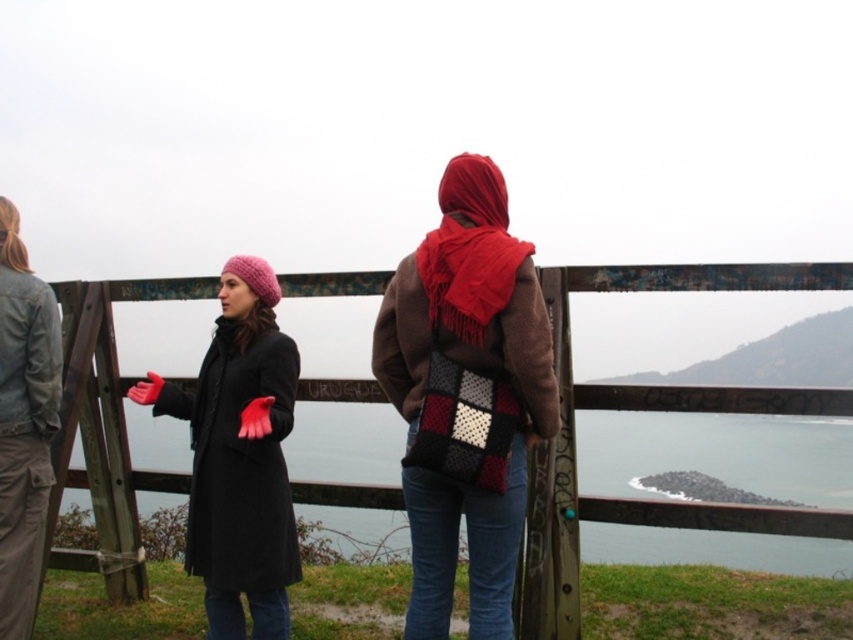
Question: Can you confirm if wooden at center is positioned to the right of knitted wool scarf at center?

Choices:
 (A) yes
 (B) no

Answer: (A)

Question: Is knitted wool scarf at center to the right of red woolen scarf at center from the viewer's perspective?

Choices:
 (A) no
 (B) yes

Answer: (A)

Question: Which object is the closest to the wooden at center?

Choices:
 (A) denim jacket at left
 (B) red woolen scarf at center
 (C) matte black coat at center
 (D) knitted wool scarf at center

Answer: (D)

Question: Can you confirm if denim jacket at left is wider than red woolen scarf at center?

Choices:
 (A) no
 (B) yes

Answer: (A)

Question: Among these objects, which one is farthest from the camera?

Choices:
 (A) denim jacket at left
 (B) matte black coat at center
 (C) red woolen scarf at center

Answer: (A)

Question: Estimate the real-world distances between objects in this image. Which object is closer to the knitted wool scarf at center?

Choices:
 (A) wooden at center
 (B) denim jacket at left

Answer: (A)